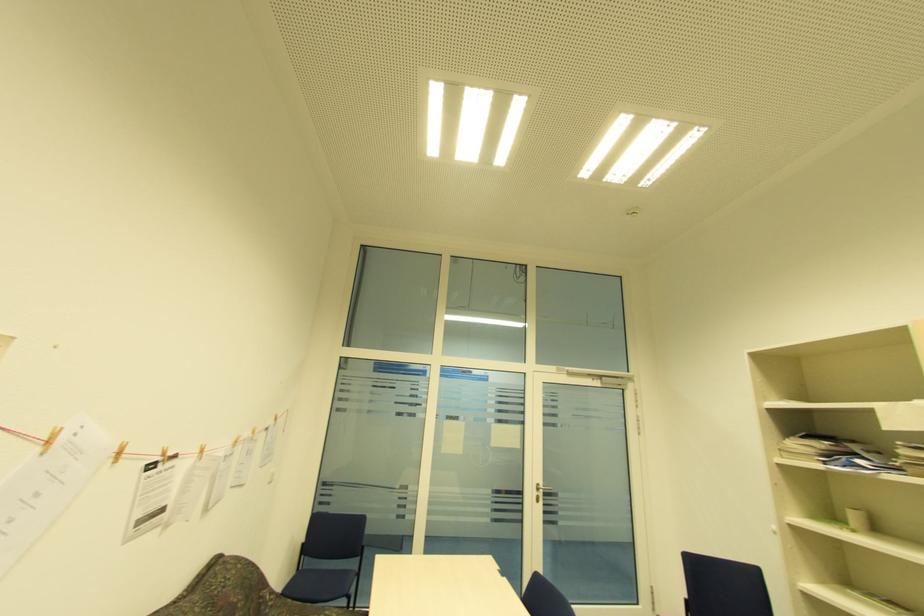
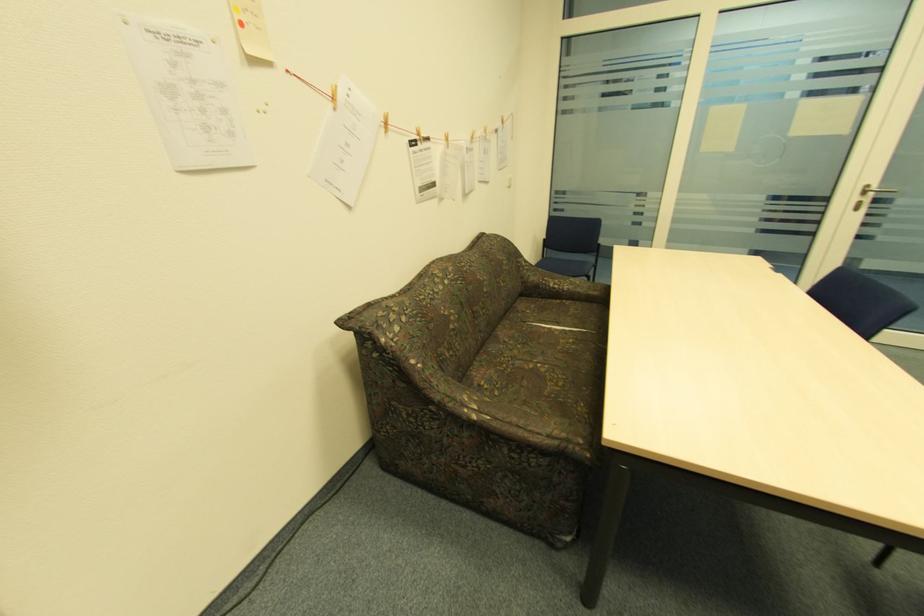
Locate, in the second image, the point that corresponds to pixel 538 493 in the first image.

(859, 199)